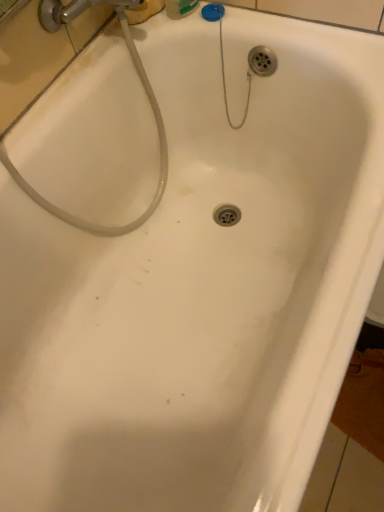
I want to click on transparent plastic hose at upper left, so click(149, 101).

Image resolution: width=384 pixels, height=512 pixels. What do you see at coordinates (149, 101) in the screenshot? I see `transparent plastic hose at upper left` at bounding box center [149, 101].

The image size is (384, 512). In order to click on transparent plastic hose at upper left in this screenshot , I will do `click(149, 101)`.